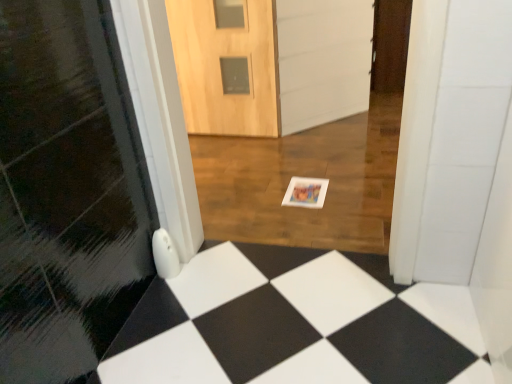
Question: From the image's perspective, is wooden door at center positioned above or below white matte postcard at center?

Choices:
 (A) below
 (B) above

Answer: (B)

Question: Relative to white matte postcard at center, is wooden door at center in front or behind?

Choices:
 (A) front
 (B) behind

Answer: (B)

Question: Is point (248, 13) closer or farther from the camera than point (287, 185)?

Choices:
 (A) closer
 (B) farther

Answer: (B)

Question: Is white matte postcard at center in front of or behind wooden door at center in the image?

Choices:
 (A) front
 (B) behind

Answer: (A)

Question: Is white matte postcard at center to the left or to the right of wooden door at center in the image?

Choices:
 (A) right
 (B) left

Answer: (A)

Question: From the image's perspective, is white matte postcard at center above or below wooden door at center?

Choices:
 (A) above
 (B) below

Answer: (B)

Question: Looking at their shapes, would you say white matte postcard at center is wider or thinner than wooden door at center?

Choices:
 (A) wide
 (B) thin

Answer: (A)